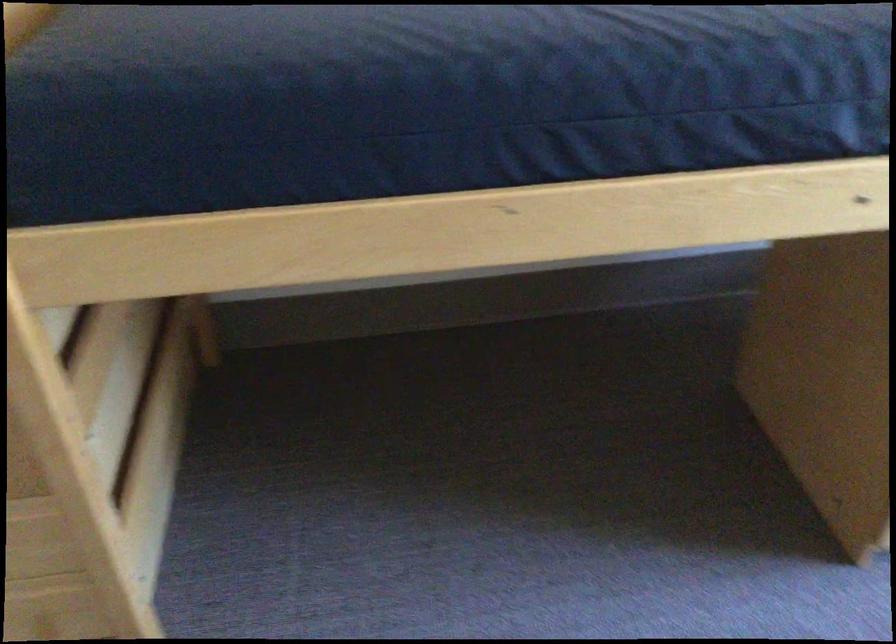
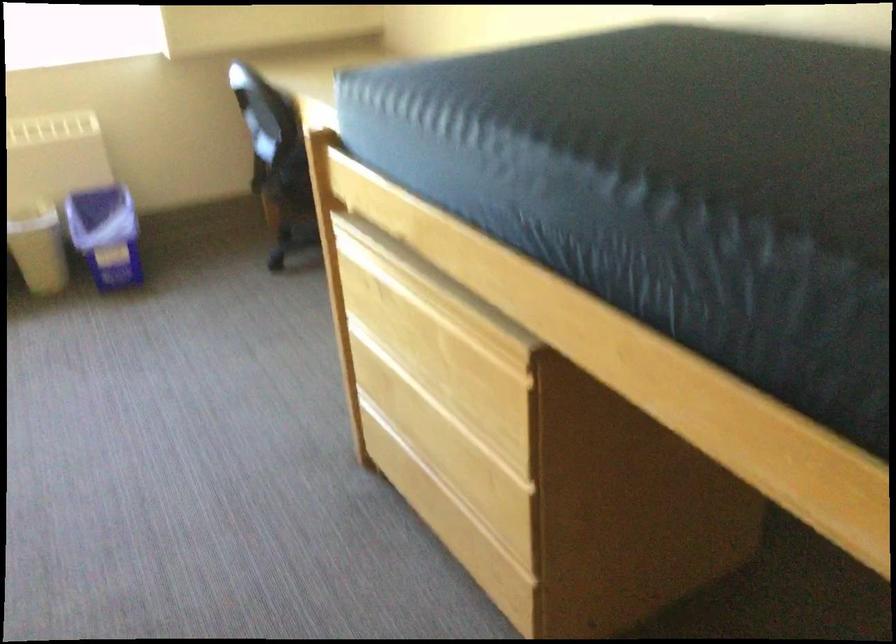
The images are taken continuously from a first-person perspective. In which direction is your viewpoint rotating?

The camera rotated toward right-down.